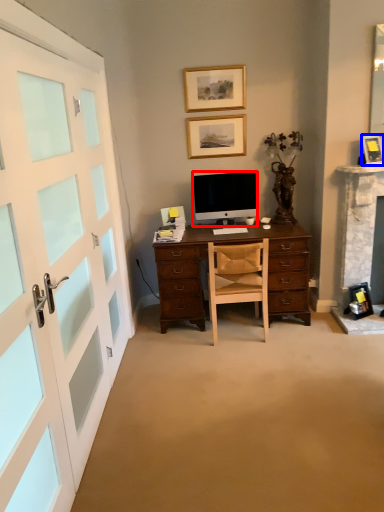
Question: Among these objects, which one is nearest to the camera, television (highlighted by a red box) or picture frame (highlighted by a blue box)?

Choices:
 (A) television
 (B) picture frame

Answer: (B)